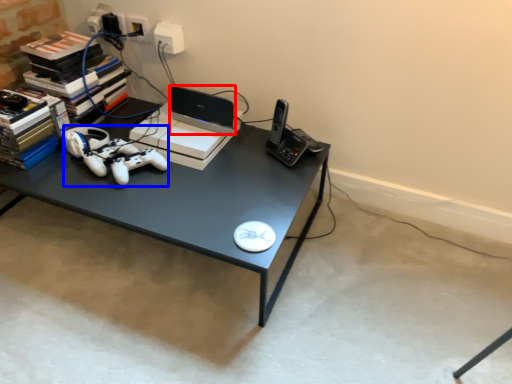
Question: Which object appears closest to the camera in this image, laptop (highlighted by a red box) or game controller (highlighted by a blue box)?

Choices:
 (A) laptop
 (B) game controller

Answer: (B)